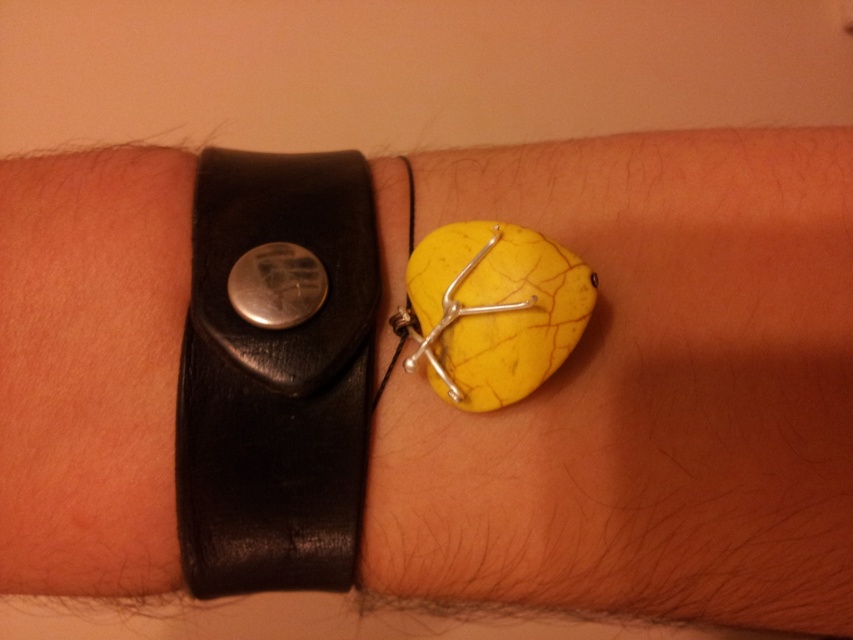
Based on the photo, who is positioned more to the right, black leather watch at left or metallic yellow ring at center?

metallic yellow ring at center is more to the right.

Locate an element on the screen. black leather watch at left is located at coordinates (276, 380).

Which is in front, point (367, 276) or point (409, 326)?

Positioned in front is point (367, 276).

The width and height of the screenshot is (853, 640). In order to click on black leather watch at left in this screenshot , I will do `click(276, 380)`.